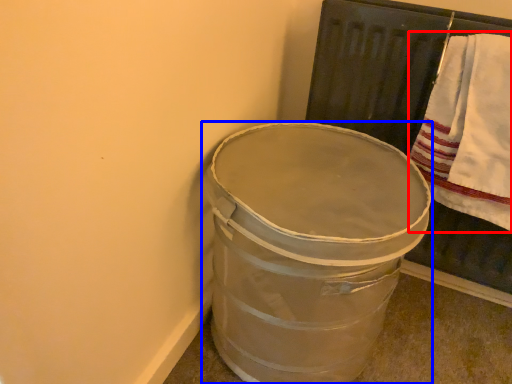
Question: Which of the following is the farthest to the observer, bath towel (highlighted by a red box) or waste container (highlighted by a blue box)?

Choices:
 (A) bath towel
 (B) waste container

Answer: (A)